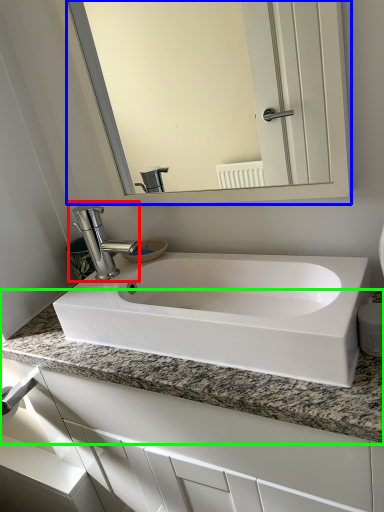
Question: Based on their relative distances, which object is farther from tap (highlighted by a red box)? Choose from mirror (highlighted by a blue box) and countertop (highlighted by a green box).

Choices:
 (A) mirror
 (B) countertop

Answer: (A)